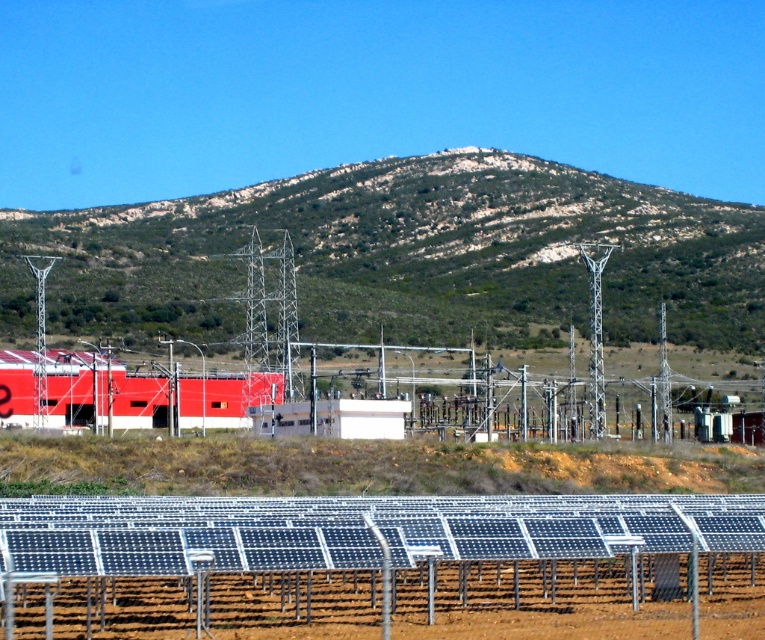
Does green textured hill at center have a lesser width compared to metallic silver fence at lower center?

No.

How far apart are green textured hill at center and metallic silver fence at lower center?

160.61 meters

Locate an element on the screen. The width and height of the screenshot is (765, 640). green textured hill at center is located at coordinates (405, 256).

I want to click on green textured hill at center, so click(405, 256).